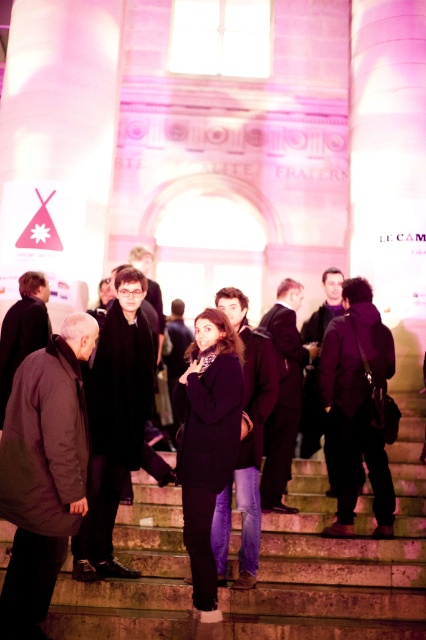
Does point (135, 556) come behind point (230, 346)?

No, it is not.

Does stone stairs at center have a greater width compared to dark purple coat at center?

Yes.

Who is more forward, (143, 593) or (201, 595)?

Point (201, 595) is in front.

You are a GUI agent. You are given a task and a screenshot of the screen. Output one action in this format:
    pyautogui.click(x=<x>, y=<y>)
    Task: Click on the stone stairs at center
    Image resolution: width=426 pixels, height=640 pixels.
    Given the screenshot: What is the action you would take?
    pyautogui.click(x=337, y=557)

Can you confirm if purple matte jacket at center is positioned to the left of matte purple coat at center?

In fact, purple matte jacket at center is to the right of matte purple coat at center.

Is purple matte jacket at center taller than matte purple coat at center?

No, purple matte jacket at center is not taller than matte purple coat at center.

Which is in front, point (331, 337) or point (275, 378)?

Point (275, 378) is in front.

Locate an element on the screen. purple matte jacket at center is located at coordinates (357, 404).

Measure the distance between stone stairs at center and camera.

They are 25.91 meters apart.

Does stone stairs at center appear on the left side of matte purple coat at center?

Incorrect, stone stairs at center is not on the left side of matte purple coat at center.

Between point (397, 493) and point (253, 401), which one is positioned behind?

The point (397, 493) is more distant.

I want to click on stone stairs at center, so click(x=337, y=557).